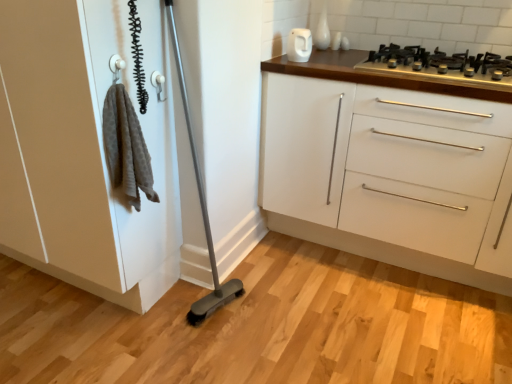
Question: Is white plastic door handle at upper center a part of white glossy cabinet at upper right?

Choices:
 (A) yes
 (B) no

Answer: (B)

Question: From the image's perspective, does white glossy cabinet at upper right appear higher than white plastic door handle at upper center?

Choices:
 (A) no
 (B) yes

Answer: (A)

Question: Is white glossy cabinet at upper right touching white plastic door handle at upper center?

Choices:
 (A) yes
 (B) no

Answer: (B)

Question: Does white glossy cabinet at upper right have a lesser width compared to white plastic door handle at upper center?

Choices:
 (A) no
 (B) yes

Answer: (A)

Question: From a real-world perspective, is white glossy cabinet at upper right below white plastic door handle at upper center?

Choices:
 (A) no
 (B) yes

Answer: (B)

Question: Based on their sizes in the image, would you say black metal gas stove at upper right is bigger or smaller than white plastic door handle at upper center?

Choices:
 (A) small
 (B) big

Answer: (B)

Question: Which is correct: black metal gas stove at upper right is inside white plastic door handle at upper center, or outside of it?

Choices:
 (A) inside
 (B) outside

Answer: (B)

Question: Considering the relative positions of black metal gas stove at upper right and white plastic door handle at upper center in the image provided, is black metal gas stove at upper right to the left or to the right of white plastic door handle at upper center?

Choices:
 (A) left
 (B) right

Answer: (B)

Question: Is black metal gas stove at upper right taller or shorter than white plastic door handle at upper center?

Choices:
 (A) tall
 (B) short

Answer: (B)

Question: Is white plastic door handle at upper center wider or thinner than white glossy cabinet at upper right?

Choices:
 (A) wide
 (B) thin

Answer: (B)

Question: From a real-world perspective, relative to white glossy cabinet at upper right, is white plastic door handle at upper center vertically above or below?

Choices:
 (A) below
 (B) above

Answer: (B)

Question: Considering the relative positions of white plastic door handle at upper center and white glossy cabinet at upper right in the image provided, is white plastic door handle at upper center to the left or to the right of white glossy cabinet at upper right?

Choices:
 (A) right
 (B) left

Answer: (B)

Question: Considering the positions of point (159, 72) and point (334, 170), is point (159, 72) closer or farther from the camera than point (334, 170)?

Choices:
 (A) farther
 (B) closer

Answer: (B)

Question: From the image's perspective, is white glossy cabinet at upper right located above or below white matte cabinet at left?

Choices:
 (A) above
 (B) below

Answer: (B)

Question: Does point (288, 114) appear closer or farther from the camera than point (41, 246)?

Choices:
 (A) closer
 (B) farther

Answer: (B)